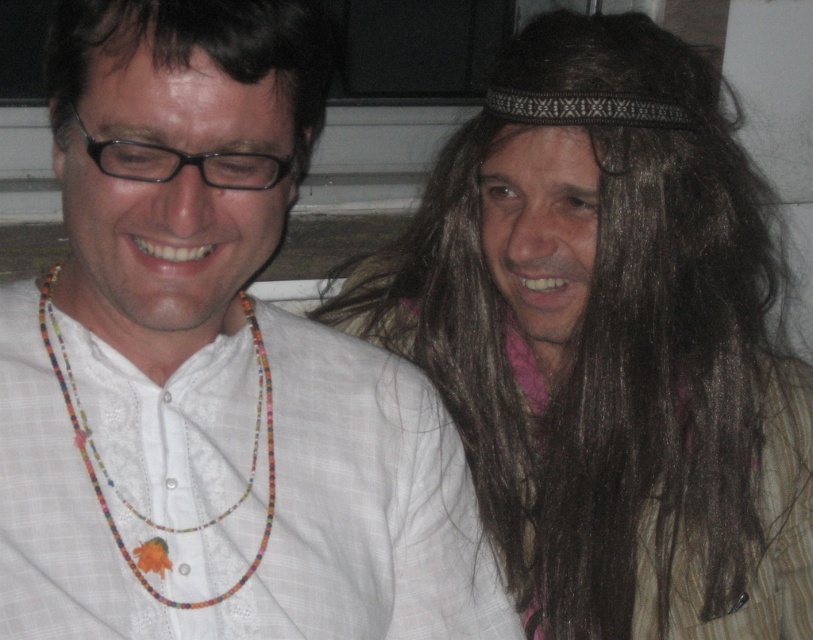
Looking at this image, how distant is brown hair at upper right from dark brown hair at upper left?

brown hair at upper right and dark brown hair at upper left are 13.78 inches apart from each other.

Between brown hair at upper right and dark brown hair at upper left, which one is positioned lower?

brown hair at upper right is below.

Who is more distant from viewer, (525, 308) or (279, 76)?

Positioned behind is point (525, 308).

What are the coordinates of `brown hair at upper right` in the screenshot? It's located at (609, 340).

Is white woven shirt at center smaller than dark brown hair at upper left?

Incorrect, white woven shirt at center is not smaller in size than dark brown hair at upper left.

Is white woven shirt at center positioned at the back of dark brown hair at upper left?

Yes, white woven shirt at center is behind dark brown hair at upper left.

Is point (218, 554) farther from camera compared to point (307, 80)?

Yes, point (218, 554) is farther from viewer.

Find the location of `white woven shirt at center`. white woven shirt at center is located at coordinates (211, 369).

How much distance is there between brown hair at upper right and beaded necklace at left?

brown hair at upper right is 31.93 centimeters from beaded necklace at left.

Is point (450, 381) farther from viewer compared to point (44, 346)?

Yes, it is.

Which is behind, point (454, 282) or point (246, 484)?

The point (454, 282) is behind.

Find the location of a particular element. This screenshot has width=813, height=640. brown hair at upper right is located at coordinates (609, 340).